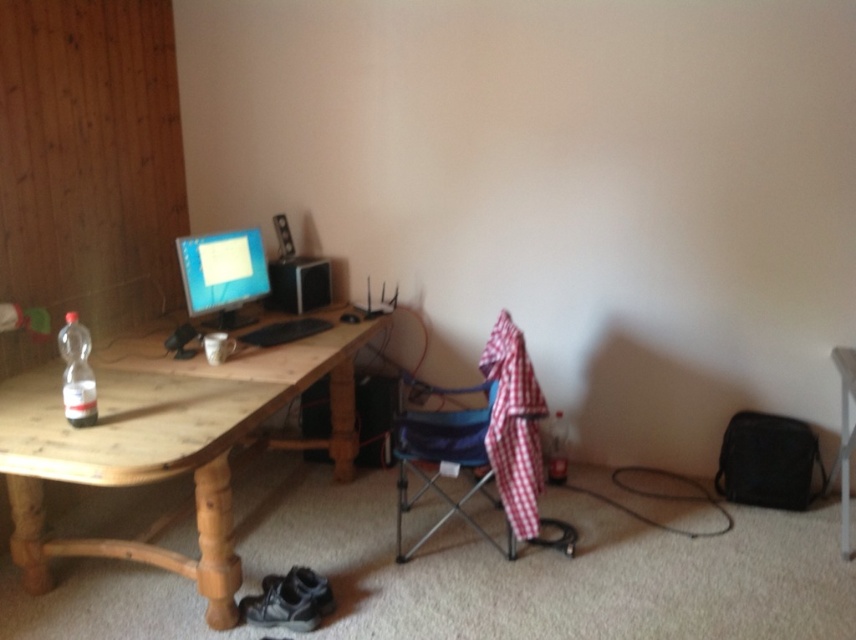
Question: Can you confirm if wooden table at left is bigger than clear plastic bottle at left?

Choices:
 (A) yes
 (B) no

Answer: (A)

Question: Based on their relative distances, which object is nearer to the matte black monitor at upper left?

Choices:
 (A) clear plastic bottle at left
 (B) plaid fabric folding chair at center
 (C) clear glass bottle at lower right

Answer: (A)

Question: Among these points, which one is nearest to the camera?

Choices:
 (A) (467, 428)
 (B) (42, 582)
 (C) (69, 323)

Answer: (C)

Question: Considering the relative positions of wooden table at left and clear plastic bottle at left in the image provided, where is wooden table at left located with respect to clear plastic bottle at left?

Choices:
 (A) above
 (B) below

Answer: (B)

Question: Is wooden table at left further to camera compared to matte black monitor at upper left?

Choices:
 (A) yes
 (B) no

Answer: (B)

Question: Which point is farther to the camera?

Choices:
 (A) plaid fabric folding chair at center
 (B) matte black monitor at upper left
 (C) clear plastic bottle at left
 (D) wooden table at left

Answer: (B)